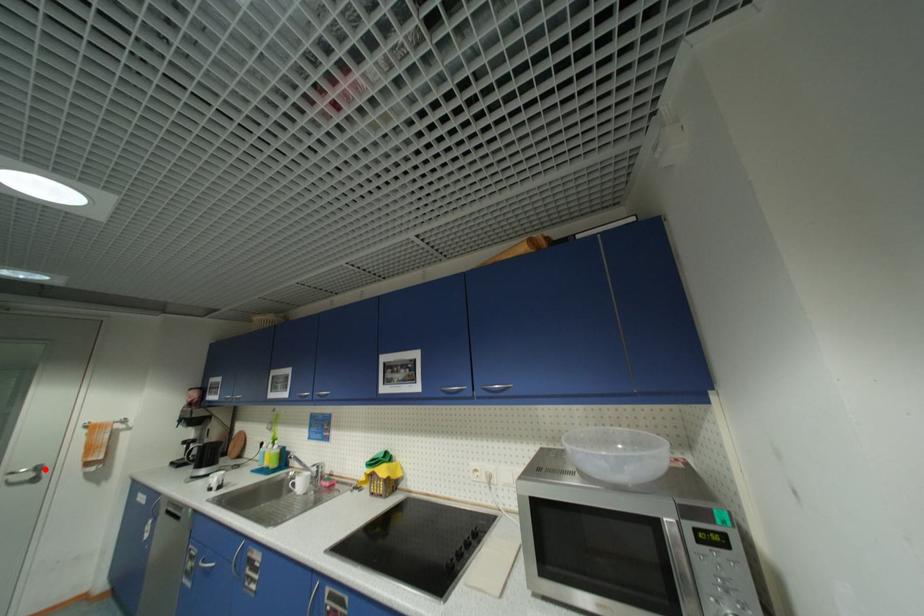
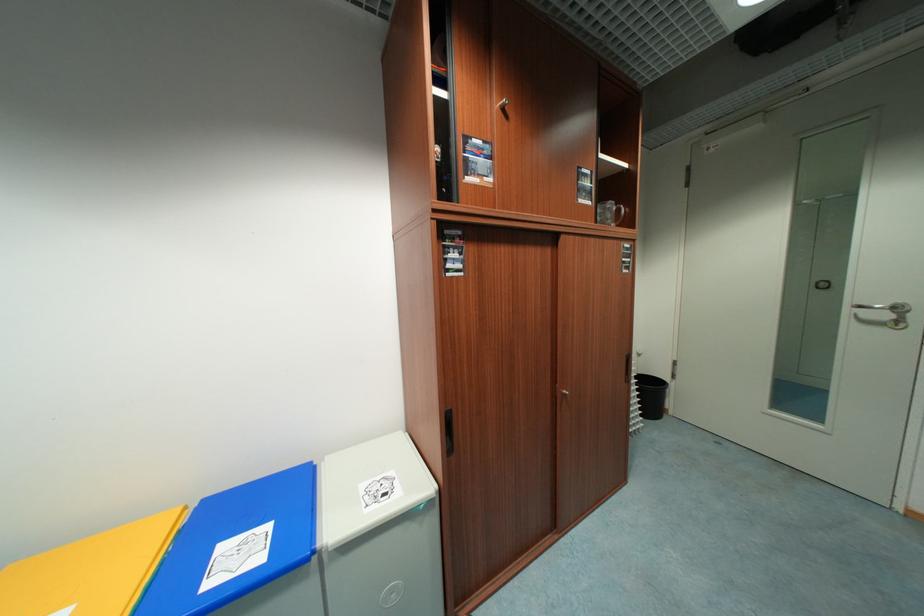
Question: I am providing you with two images of the same scene from different viewpoints. Image1 has a red point marked. In image2, the corresponding 3D location appears at what relative position? Reply with the corresponding letter.

Choices:
 (A) Closer
 (B) Farther

Answer: (B)